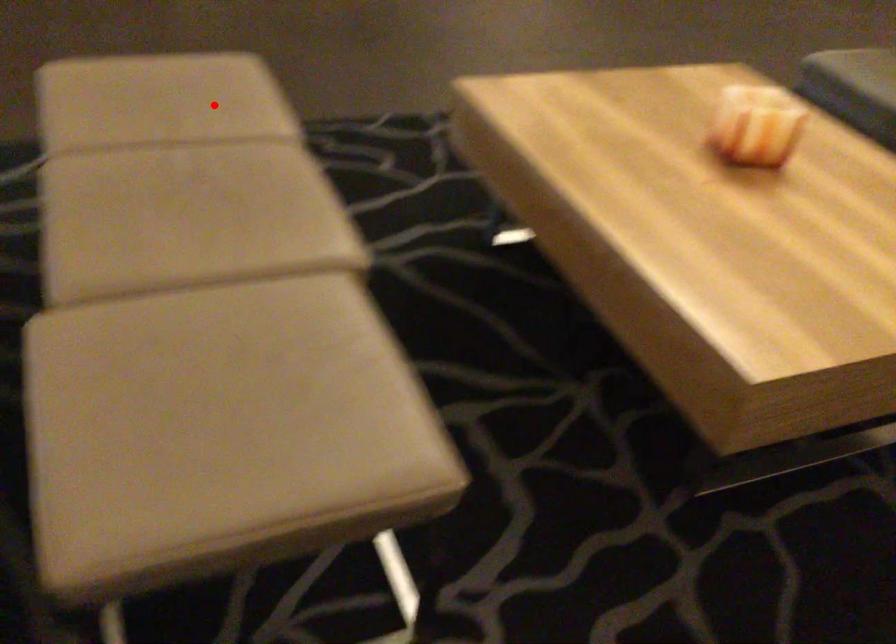
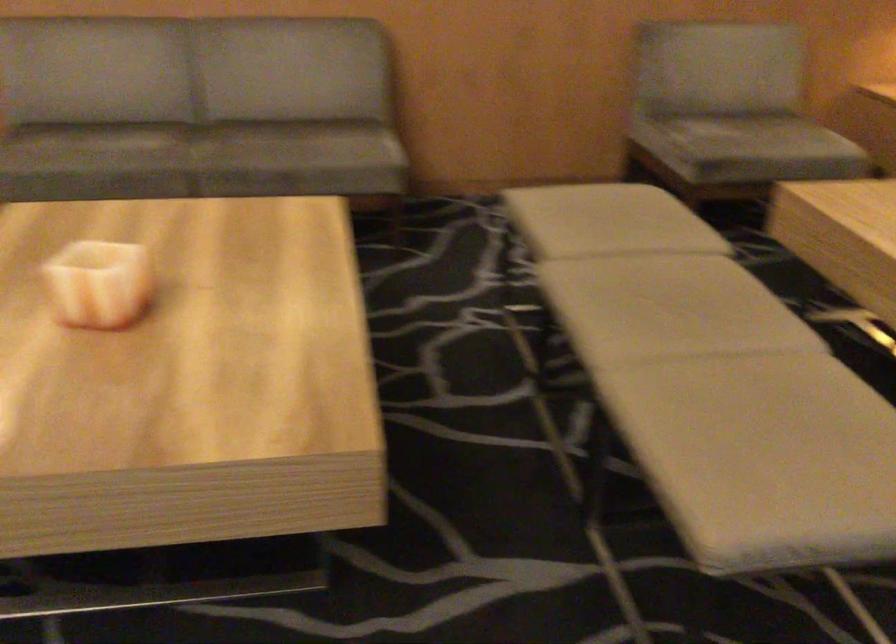
Find the pixel in the second image that matches the highlighted location in the first image.

(712, 383)